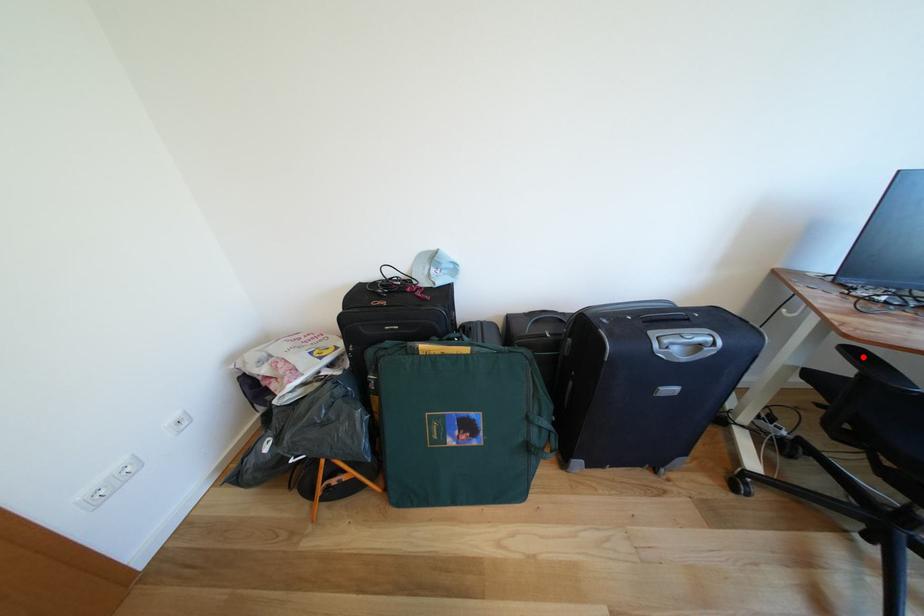
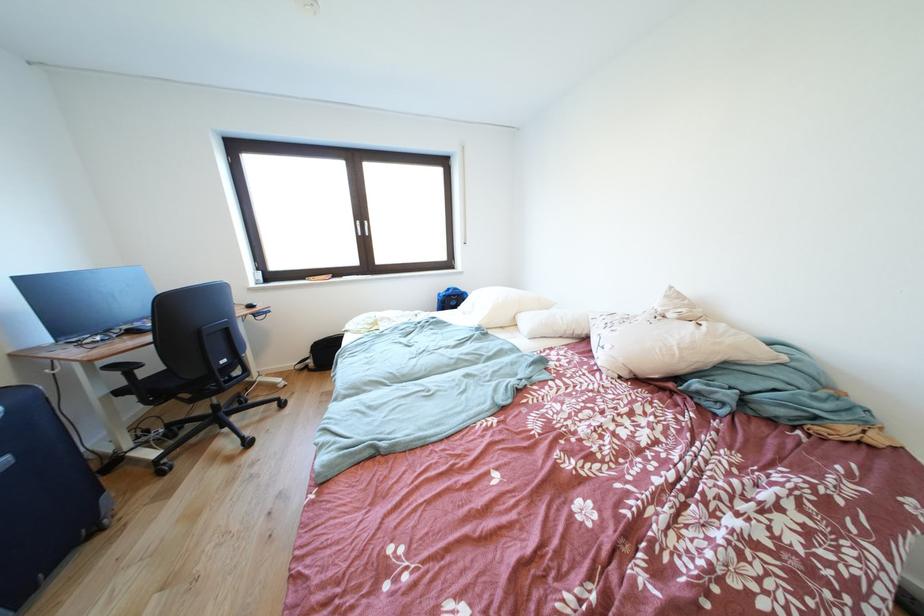
Where in the second image is the point corresponding to the highlighted location from the first image?

(120, 371)